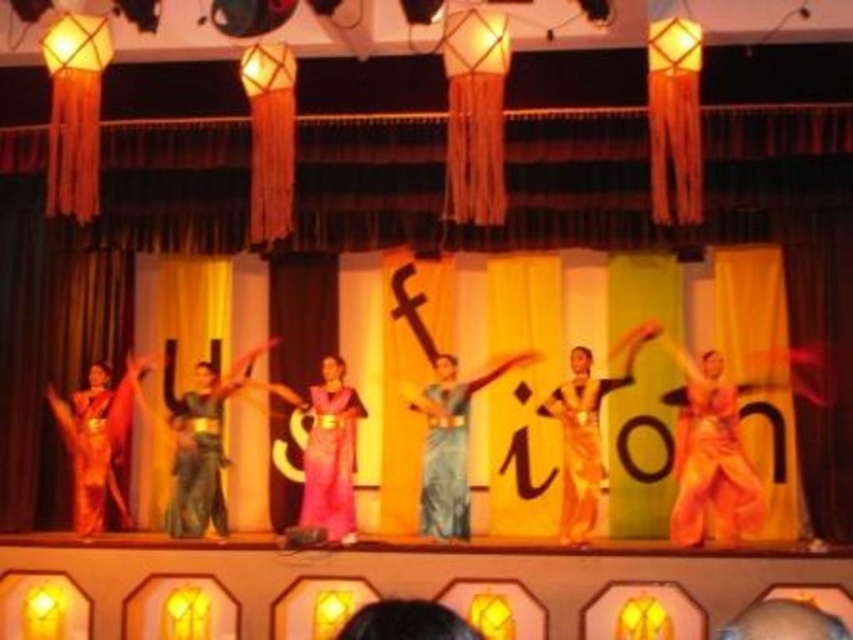
You are a photographer at the back of the stage. You want to capture a photo where both the orange fabric at center and the matte green saree at center are clearly visible. Given their sizes, which object might you need to adjust your camera focus to ensure it appears more detailed in the photo?

The orange fabric at center is smaller than the matte green saree at center, so you might need to adjust the camera focus on the orange fabric at center to ensure its smaller details are captured clearly.

Looking at this image, you are a photographer capturing the stage performance. You notice two items at the center of the stage, the orange fabric at center and the matte green saree at center. Which one is positioned to the right side of the other?

The orange fabric at center is positioned to the right of the matte green saree at center.

You are a stagehand who needs to place a new spotlight on the stage. The spotlight can only illuminate objects within a radius of 0.5 units from its position. If you position the spotlight at point 0.5, 0.5, will it illuminate the orange fabric at center?

The orange fabric at center is located at point (711,458). The distance between the spotlight at (426,320) and the orange fabric at center is sqrt of squared differences in x and y coordinates. Calculating sqrt of squared difference in x is 0.216 squared is 0.046656, squared difference in y is 0.335 squared is 0.112225. Total squared distance is 0.158881. Square root of that is approximately 0.3986, which is less than 0.5. Therefore, the spotlight will illuminate the orange fabric at center.